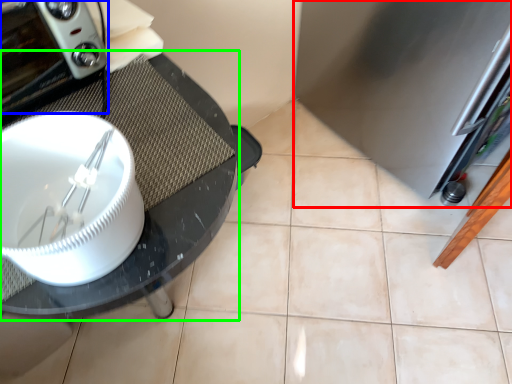
Question: Considering the real-world distances, which object is closest to appliance (highlighted by a red box)? home appliance (highlighted by a blue box) or glass table (highlighted by a green box).

Choices:
 (A) home appliance
 (B) glass table

Answer: (B)